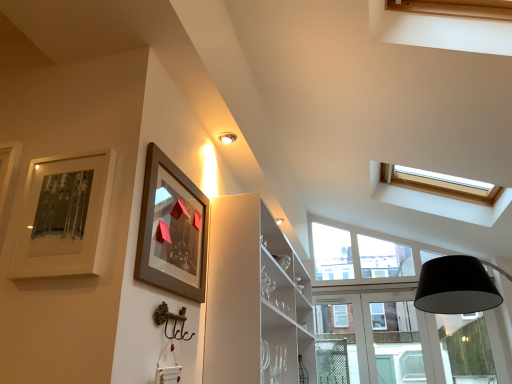
Question: Is matte silver picture frame at upper left, the 1th picture frame from the left, smaller than matte brown picture frame at upper left, which appears as the second picture frame when viewed from the left?

Choices:
 (A) yes
 (B) no

Answer: (A)

Question: Does matte silver picture frame at upper left, which appears as the 2th picture frame when viewed from the right, have a lesser width compared to matte brown picture frame at upper left, which appears as the second picture frame when viewed from the left?

Choices:
 (A) no
 (B) yes

Answer: (B)

Question: Is matte silver picture frame at upper left, which appears as the 2th picture frame when viewed from the right, far away from matte brown picture frame at upper left, which appears as the second picture frame when viewed from the left?

Choices:
 (A) yes
 (B) no

Answer: (B)

Question: Is matte silver picture frame at upper left, which appears as the 2th picture frame when viewed from the right, to the right of matte brown picture frame at upper left, acting as the first picture frame starting from the right, from the viewer's perspective?

Choices:
 (A) yes
 (B) no

Answer: (B)

Question: From the image's perspective, is matte silver picture frame at upper left, the 1th picture frame from the left, on matte brown picture frame at upper left, which appears as the second picture frame when viewed from the left?

Choices:
 (A) yes
 (B) no

Answer: (A)

Question: Is matte silver picture frame at upper left, which appears as the 2th picture frame when viewed from the right, closer to the viewer compared to matte brown picture frame at upper left, which appears as the second picture frame when viewed from the left?

Choices:
 (A) no
 (B) yes

Answer: (B)

Question: Is clear glass window at center positioned before matte silver picture frame at upper left, the 1th picture frame from the left?

Choices:
 (A) no
 (B) yes

Answer: (A)

Question: Is clear glass window at center to the left of matte silver picture frame at upper left, which appears as the 2th picture frame when viewed from the right, from the viewer's perspective?

Choices:
 (A) yes
 (B) no

Answer: (B)

Question: Is clear glass window at center turned away from matte silver picture frame at upper left, the 1th picture frame from the left?

Choices:
 (A) yes
 (B) no

Answer: (B)

Question: Does clear glass window at center have a greater width compared to matte silver picture frame at upper left, which appears as the 2th picture frame when viewed from the right?

Choices:
 (A) no
 (B) yes

Answer: (B)

Question: Is clear glass window at center taller than matte silver picture frame at upper left, which appears as the 2th picture frame when viewed from the right?

Choices:
 (A) no
 (B) yes

Answer: (B)

Question: Is clear glass window at center thinner than matte silver picture frame at upper left, which appears as the 2th picture frame when viewed from the right?

Choices:
 (A) yes
 (B) no

Answer: (B)

Question: Can you see clear glass window at center touching matte brown picture frame at upper left, acting as the first picture frame starting from the right?

Choices:
 (A) yes
 (B) no

Answer: (B)